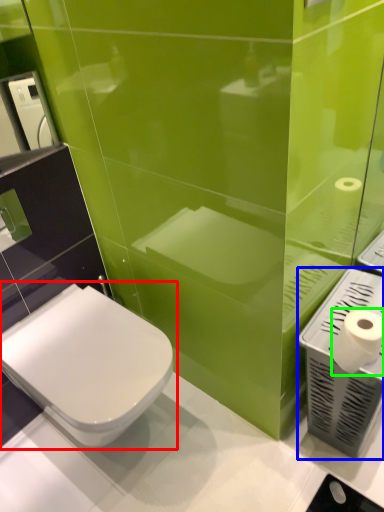
Question: Which object is positioned farthest from toilet (highlighted by a red box)? Select from hand dryer (highlighted by a blue box) and toilet paper (highlighted by a green box).

Choices:
 (A) hand dryer
 (B) toilet paper

Answer: (B)